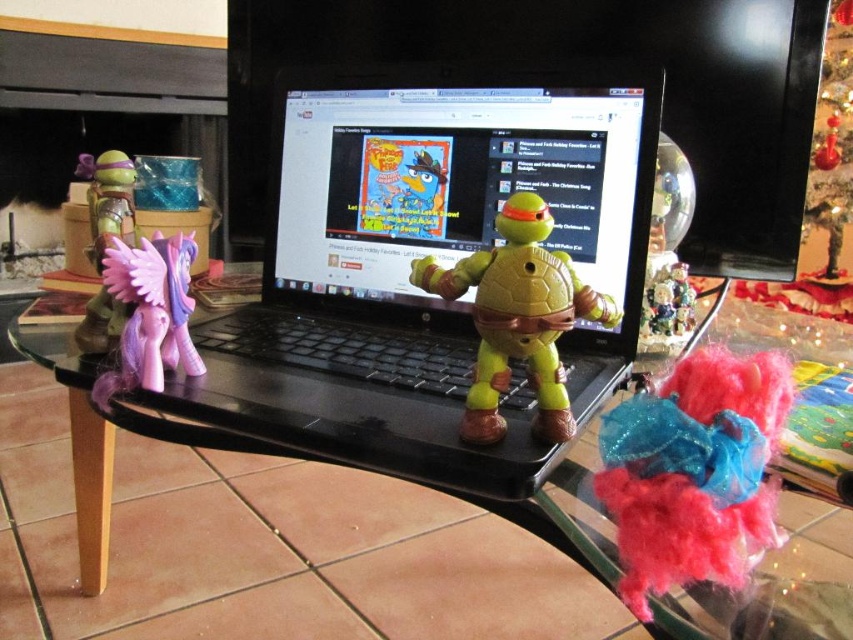
Who is taller, transparent glass table at center or fuzzy fabric toy at lower right?

With more height is transparent glass table at center.

Does transparent glass table at center appear under fuzzy fabric toy at lower right?

Yes.

Find the location of a particular element. transparent glass table at center is located at coordinates tap(265, 541).

You are a GUI agent. You are given a task and a screenshot of the screen. Output one action in this format:
    pyautogui.click(x=<x>, y=<y>)
    Task: Click on the transparent glass table at center
    
    Given the screenshot: What is the action you would take?
    pyautogui.click(x=265, y=541)

Measure the distance from shiny plastic laptop at center to fuzzy fabric toy at lower right.

shiny plastic laptop at center and fuzzy fabric toy at lower right are 12.72 inches apart from each other.

Is shiny plastic laptop at center to the left of fuzzy fabric toy at lower right from the viewer's perspective?

Correct, you'll find shiny plastic laptop at center to the left of fuzzy fabric toy at lower right.

Identify the location of shiny plastic laptop at center. Image resolution: width=853 pixels, height=640 pixels. (457, 179).

Identify the location of transparent glass table at center. (265, 541).